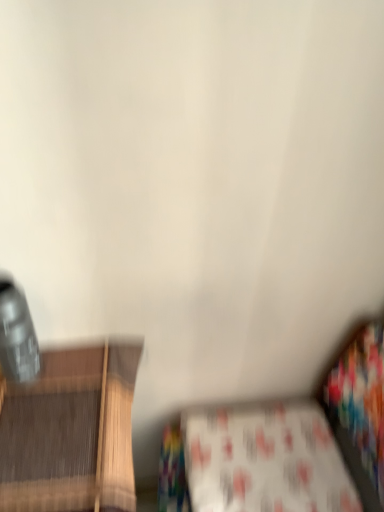
What is the approximate width of white printed fabric at lower center?

white printed fabric at lower center is 26.47 centimeters wide.

Where is `white printed fabric at lower center`? white printed fabric at lower center is located at coordinates (265, 459).

This screenshot has width=384, height=512. Describe the element at coordinates (265, 459) in the screenshot. I see `white printed fabric at lower center` at that location.

You are a GUI agent. You are given a task and a screenshot of the screen. Output one action in this format:
    pyautogui.click(x=<x>, y=<y>)
    Task: Click on the white fabric couch at lower right
    The height and width of the screenshot is (512, 384).
    Given the screenshot: What is the action you would take?
    pyautogui.click(x=286, y=445)

What do you see at coordinates (286, 445) in the screenshot?
I see `white fabric couch at lower right` at bounding box center [286, 445].

Find the location of a particular element. This screenshot has height=512, width=384. white printed fabric at lower center is located at coordinates (265, 459).

Considering the positions of objects white fabric couch at lower right and white printed fabric at lower center in the image provided, who is more to the right, white fabric couch at lower right or white printed fabric at lower center?

white printed fabric at lower center is more to the right.

Does white fabric couch at lower right come in front of white printed fabric at lower center?

Yes, the depth of white fabric couch at lower right is less than that of white printed fabric at lower center.

Between point (268, 504) and point (192, 465), which one is positioned in front?

The point (268, 504) is in front.

Consider the image. From the image's perspective, is white fabric couch at lower right below white printed fabric at lower center?

Yes.

From a real-world perspective, is white fabric couch at lower right over white printed fabric at lower center?

No, from a real-world perspective, white fabric couch at lower right is not over white printed fabric at lower center

Based on the photo, between white fabric couch at lower right and white printed fabric at lower center, which one has larger width?

white fabric couch at lower right.

Is white fabric couch at lower right taller or shorter than white printed fabric at lower center?

white fabric couch at lower right is taller than white printed fabric at lower center.

Which of these two, white fabric couch at lower right or white printed fabric at lower center, is bigger?

With larger size is white fabric couch at lower right.

Is white fabric couch at lower right completely or partially outside of white printed fabric at lower center?

white fabric couch at lower right lies outside white printed fabric at lower center's area.

Is white fabric couch at lower right far from white printed fabric at lower center?

No, white fabric couch at lower right is in close proximity to white printed fabric at lower center.

Is white fabric couch at lower right turned away from white printed fabric at lower center?

That's right, white fabric couch at lower right is facing away from white printed fabric at lower center.

Where is `studio couch below the white printed fabric at lower center (from a real-world perspective)`? The image size is (384, 512). studio couch below the white printed fabric at lower center (from a real-world perspective) is located at coordinates (286, 445).

Considering the relative positions of white printed fabric at lower center and white fabric couch at lower right in the image provided, is white printed fabric at lower center to the left of white fabric couch at lower right from the viewer's perspective?

No, white printed fabric at lower center is not to the left of white fabric couch at lower right.

Considering their positions, is white printed fabric at lower center located in front of or behind white fabric couch at lower right?

Visually, white printed fabric at lower center is located behind white fabric couch at lower right.

Between point (256, 506) and point (168, 483), which one is positioned behind?

The point (168, 483) is farther.

From the image's perspective, is white printed fabric at lower center located above white fabric couch at lower right?

Indeed, from the image's perspective, white printed fabric at lower center is shown above white fabric couch at lower right.

From a real-world perspective, is white printed fabric at lower center below white fabric couch at lower right?

Actually, white printed fabric at lower center is physically above white fabric couch at lower right in the real world.

Is white printed fabric at lower center wider than white fabric couch at lower right?

Incorrect, the width of white printed fabric at lower center does not surpass that of white fabric couch at lower right.

Which of these two, white printed fabric at lower center or white fabric couch at lower right, stands taller?

Standing taller between the two is white fabric couch at lower right.

Is white printed fabric at lower center bigger or smaller than white fabric couch at lower right?

Clearly, white printed fabric at lower center is smaller in size than white fabric couch at lower right.

Would you say white printed fabric at lower center contains white fabric couch at lower right?

No.

Would you consider white printed fabric at lower center to be distant from white fabric couch at lower right?

white printed fabric at lower center is actually quite close to white fabric couch at lower right.

Could you tell me if white printed fabric at lower center is turned towards white fabric couch at lower right?

Yes, white printed fabric at lower center is aimed at white fabric couch at lower right.

How different are the orientations of white printed fabric at lower center and white fabric couch at lower right in degrees?

The angle between the facing direction of white printed fabric at lower center and the facing direction of white fabric couch at lower right is 89 degrees.

At what (x,y) coordinates should I click in order to perform the action: click on sheet on the right of white fabric couch at lower right. Please return your answer as a coordinate pair (x, y). Image resolution: width=384 pixels, height=512 pixels. Looking at the image, I should click on (265, 459).

Where is `studio couch below the white printed fabric at lower center (from the image's perspective)`? This screenshot has height=512, width=384. studio couch below the white printed fabric at lower center (from the image's perspective) is located at coordinates (286, 445).

Where is `studio couch that appears on the left of white printed fabric at lower center`? The height and width of the screenshot is (512, 384). studio couch that appears on the left of white printed fabric at lower center is located at coordinates (286, 445).